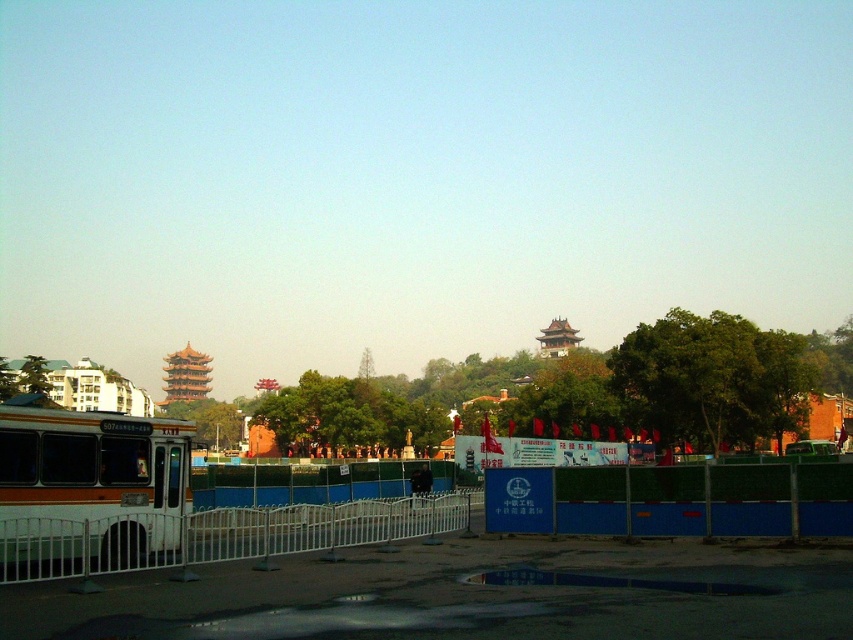
Is orange matte bus at lower left wider than white metal fence at lower left?

In fact, orange matte bus at lower left might be narrower than white metal fence at lower left.

Where is `orange matte bus at lower left`? The height and width of the screenshot is (640, 853). orange matte bus at lower left is located at coordinates (91, 484).

Which is in front, point (612, 506) or point (294, 520)?

Point (294, 520) is in front.

Does blue fabric fence at center appear on the left side of white metal fence at lower left?

In fact, blue fabric fence at center is to the right of white metal fence at lower left.

Measure the distance between blue fabric fence at center and camera.

A distance of 69.84 feet exists between blue fabric fence at center and camera.

Image resolution: width=853 pixels, height=640 pixels. What are the coordinates of `blue fabric fence at center` in the screenshot? It's located at (671, 500).

Which is behind, point (135, 554) or point (575, 486)?

Point (575, 486)

I want to click on orange matte bus at lower left, so click(91, 484).